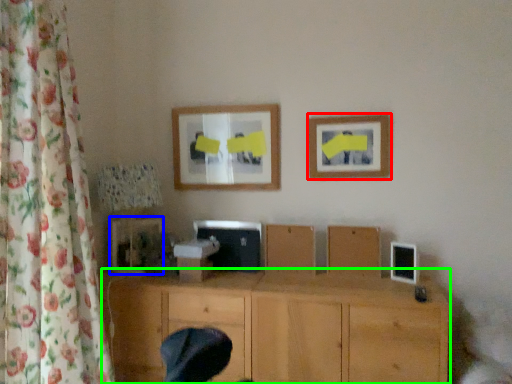
Question: Considering the real-world distances, which object is closest to picture frame (highlighted by a red box)? picture frame (highlighted by a blue box) or wood (highlighted by a green box).

Choices:
 (A) picture frame
 (B) wood

Answer: (B)